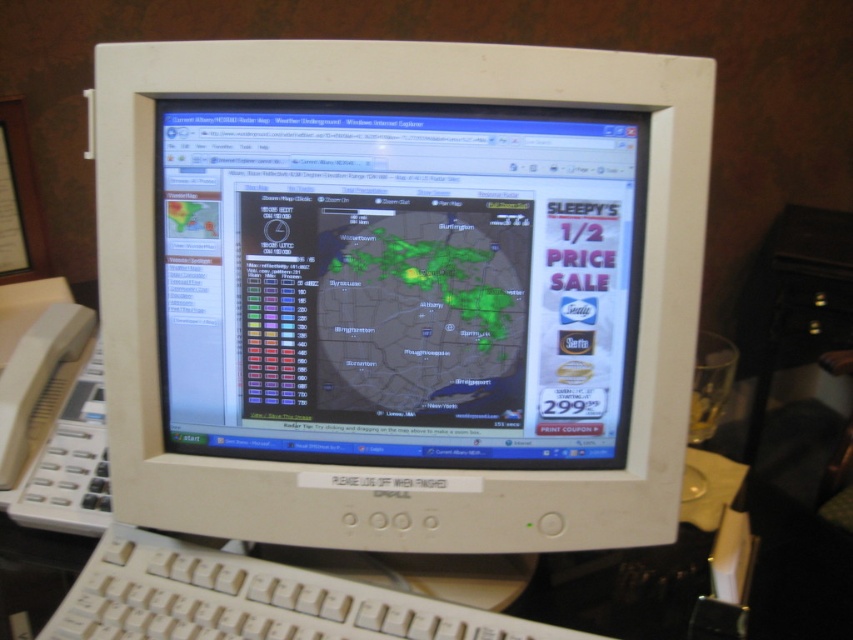
Question: Which object appears farthest from the camera in this image?

Choices:
 (A) white plastic monitor at center
 (B) white plastic keyboard at lower center

Answer: (A)

Question: Is white plastic monitor at center bigger than white plastic keyboard at lower center?

Choices:
 (A) yes
 (B) no

Answer: (A)

Question: Is white plastic monitor at center to the right of white plastic keyboard at lower center from the viewer's perspective?

Choices:
 (A) no
 (B) yes

Answer: (B)

Question: In this image, where is white plastic monitor at center located relative to white plastic keyboard at lower center?

Choices:
 (A) left
 (B) right

Answer: (B)